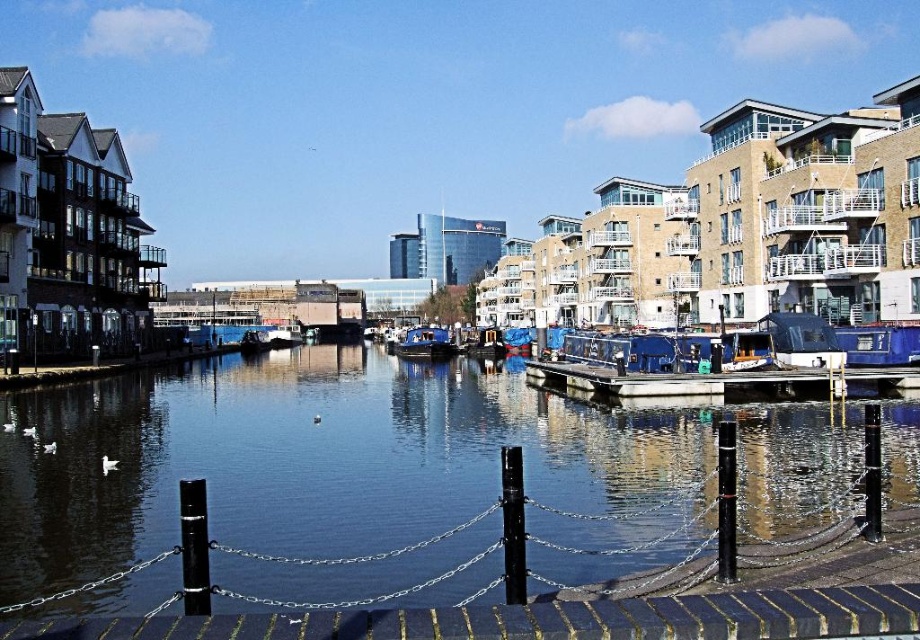
You are a delivery drone operator who needs to fly a drone from the dark blue water at center to the blue matte boat at center. Can you safely navigate the drone through this path if the drone has a maximum flight range of 70 meters?

The distance between the dark blue water at center and the blue matte boat at center is 71.95 meters, which exceeds the drone operator maximum flight range of 70 meters. Therefore, the drone cannot safely navigate this path.

You are standing on the blue painted wood dock at center and want to see the dark blue water at center. In which direction should you look relative to the dock?

You should look forward because the dark blue water at center is in front of the blue painted wood dock at center.